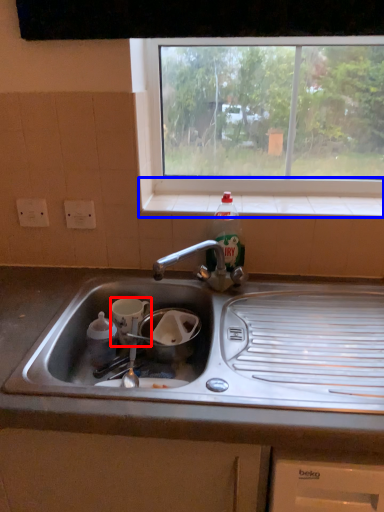
Question: Which point is closer to the camera, appliance (highlighted by a red box) or window sill (highlighted by a blue box)?

Choices:
 (A) appliance
 (B) window sill

Answer: (A)